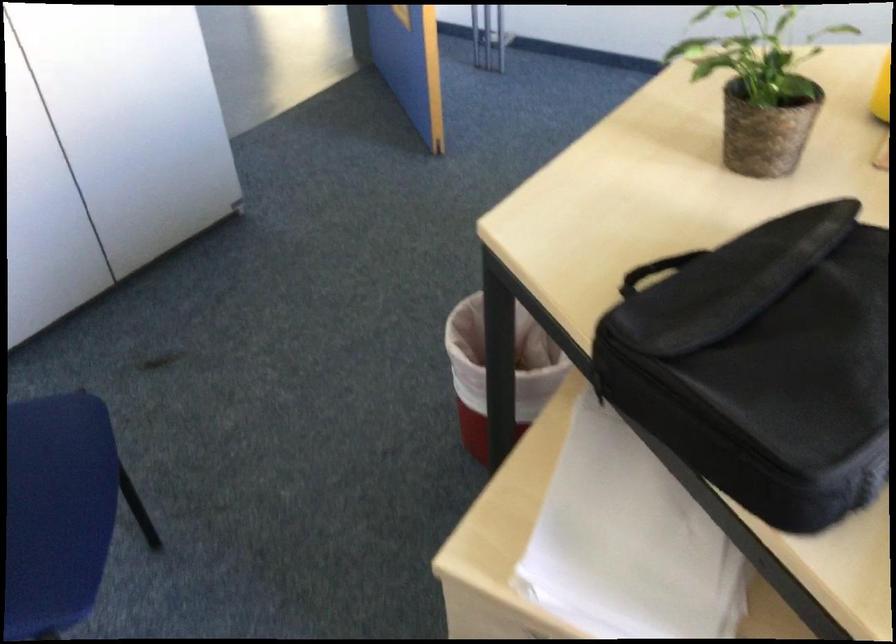
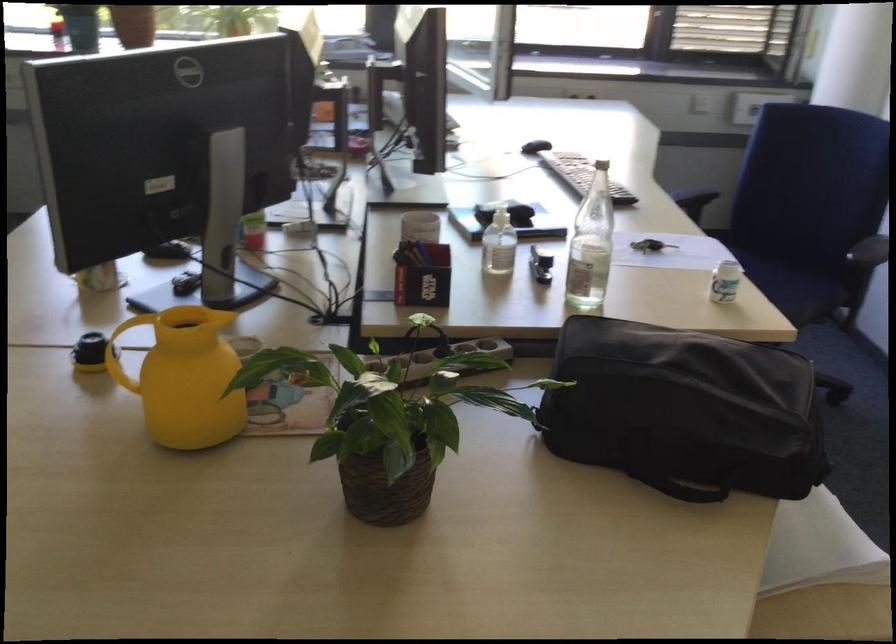
Locate, in the second image, the point that corresponds to pixel 739 158 in the first image.

(383, 484)